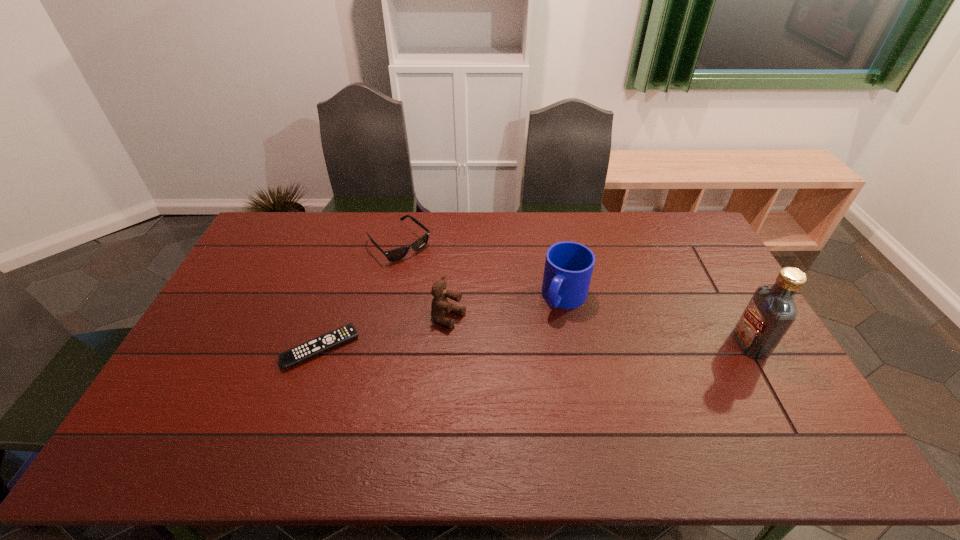
Where is `remote control`? The width and height of the screenshot is (960, 540). remote control is located at coordinates (289, 358).

Find the location of a particular element. The width and height of the screenshot is (960, 540). the rightmost object is located at coordinates (771, 311).

Identify the location of the tallest object. The width and height of the screenshot is (960, 540). (771, 311).

This screenshot has height=540, width=960. I want to click on the third object from left to right, so pos(440,305).

Where is `mug`? mug is located at coordinates (569, 265).

At what (x,y) coordinates should I click in order to perform the action: click on sunglasses. Please return your answer as a coordinate pair (x, y). Looking at the image, I should click on (396, 254).

This screenshot has height=540, width=960. I want to click on the farthest object, so click(x=396, y=254).

At what (x,y) coordinates should I click in order to perform the action: click on vacant space located 0.100m on the back of the shortest object. Please return your answer as a coordinate pair (x, y). Image resolution: width=960 pixels, height=540 pixels. Looking at the image, I should click on (336, 302).

This screenshot has width=960, height=540. Identify the location of vacant area located on the front-facing side of the tallest object. (623, 343).

Identify the location of vacant space located 0.240m on the front-facing side of the tallest object. The image size is (960, 540). [654, 343].